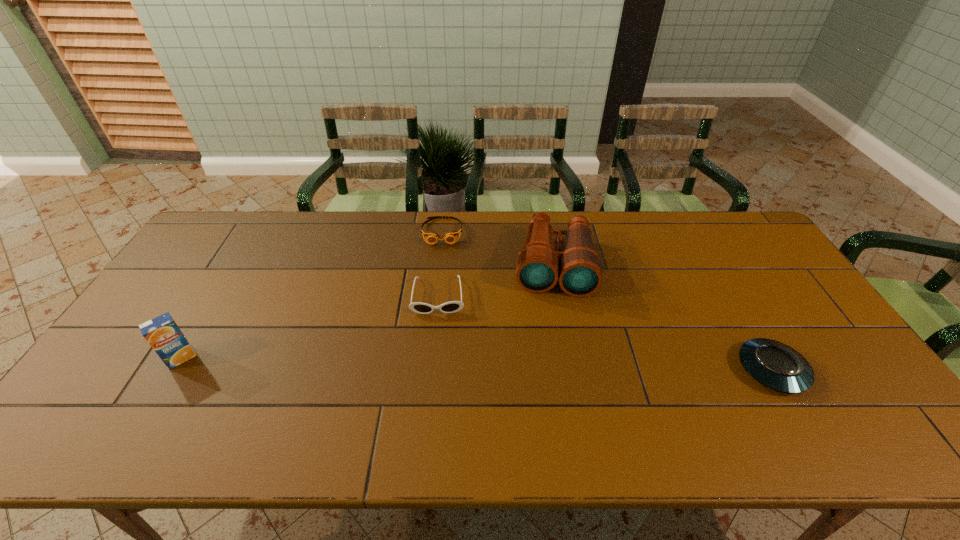
The height and width of the screenshot is (540, 960). I want to click on the leftmost object, so click(162, 333).

Image resolution: width=960 pixels, height=540 pixels. Find the location of `the rightmost object`. the rightmost object is located at coordinates (775, 365).

I want to click on the second object from right to left, so click(x=579, y=268).

Locate an element on the screen. This screenshot has height=540, width=960. goggles is located at coordinates (450, 237).

This screenshot has width=960, height=540. Identify the location of sunglasses. (453, 306).

The image size is (960, 540). What are the coordinates of `free spot located 0.380m on the right of the orange_juice` in the screenshot? It's located at (342, 357).

The height and width of the screenshot is (540, 960). I want to click on free location located on the back of the rightmost object, so click(x=717, y=276).

The height and width of the screenshot is (540, 960). Identify the location of vacant point located 0.300m through the lenses of the binoculars. (550, 386).

At what (x,y) coordinates should I click in order to perform the action: click on free space located 0.190m through the lenses of the binoculars. Please return your answer as a coordinate pair (x, y). The width and height of the screenshot is (960, 540). Looking at the image, I should click on 551,350.

Image resolution: width=960 pixels, height=540 pixels. Identify the location of free space located through the lenses of the binoculars. (550, 396).